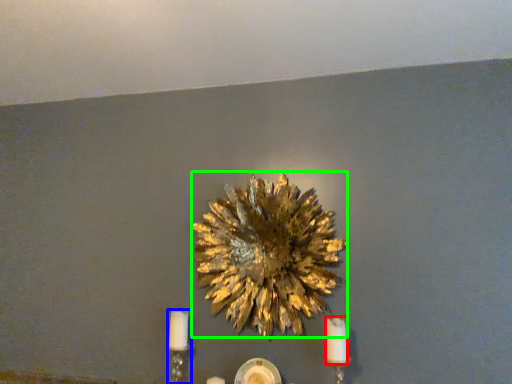
Question: Estimate the real-world distances between objects in this image. Which object is closer to candle (highlighted by a red box), candle holder (highlighted by a blue box) or flower (highlighted by a green box)?

Choices:
 (A) candle holder
 (B) flower

Answer: (B)